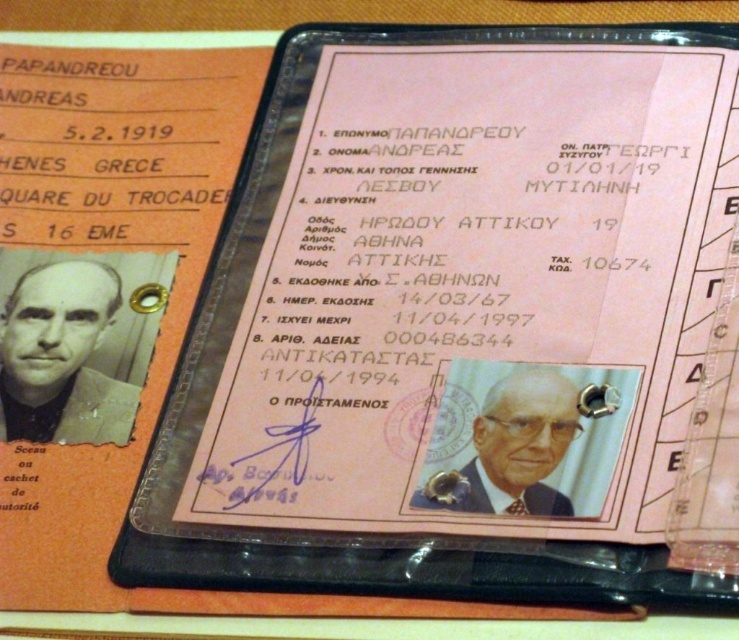
Is gray hair man at left smaller than white textured photo at center?

No.

Is point (78, 294) positioned after point (521, 378)?

Yes, point (78, 294) is behind point (521, 378).

Who is more distant from viewer, (23, 278) or (582, 428)?

The point (23, 278) is behind.

Find the location of a particular element. gray hair man at left is located at coordinates (61, 356).